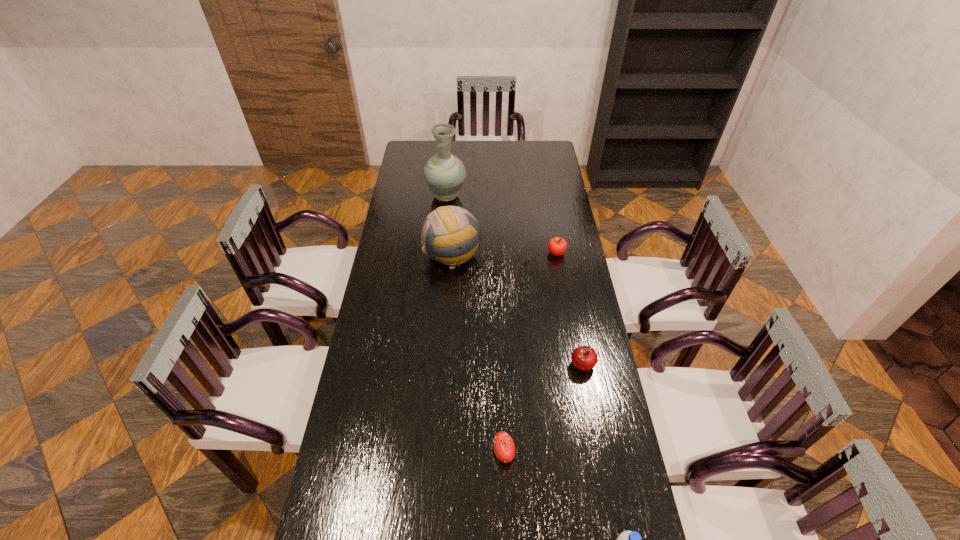
What are the coordinates of `vacant point located 0.280m on the front of the second tallest object` in the screenshot? It's located at (447, 330).

Where is `blank space located on the back of the farthest apple`? blank space located on the back of the farthest apple is located at coordinates (548, 205).

The width and height of the screenshot is (960, 540). I want to click on vacant position located on the left of the fourth farthest object, so click(492, 365).

This screenshot has width=960, height=540. In order to click on vacant point located 0.360m on the back of the third object from left to right in this screenshot , I will do `click(499, 340)`.

Find the location of a particular element. object that is positioned at the left edge is located at coordinates (444, 173).

The height and width of the screenshot is (540, 960). Identify the location of free space at the far edge. (474, 158).

The image size is (960, 540). In order to click on blank space at the left edge of the desktop in this screenshot , I will do `click(358, 507)`.

Where is `free space at the right edge of the desktop`? free space at the right edge of the desktop is located at coordinates (553, 202).

Find the location of a particular element. Image resolution: width=960 pixels, height=540 pixels. free space at the far right corner of the desktop is located at coordinates (549, 158).

You are a GUI agent. You are given a task and a screenshot of the screen. Output one action in this format:
    pyautogui.click(x=<x>, y=<y>)
    Task: Click on the empty space between the nearest apple and the volleyball
    This screenshot has width=960, height=540.
    Given the screenshot: What is the action you would take?
    pyautogui.click(x=478, y=354)